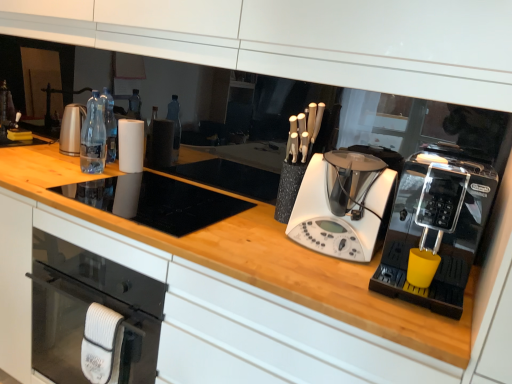
Question: Does white plastic blender at center, acting as the second home appliance starting from the right, appear on the right side of clear plastic bottles at center?

Choices:
 (A) yes
 (B) no

Answer: (A)

Question: Does white plastic blender at center, acting as the second home appliance starting from the right, have a lesser height compared to clear plastic bottles at center?

Choices:
 (A) yes
 (B) no

Answer: (A)

Question: Considering the relative sizes of white plastic blender at center, acting as the second home appliance starting from the right, and clear plastic bottles at center in the image provided, is white plastic blender at center, acting as the second home appliance starting from the right, bigger than clear plastic bottles at center?

Choices:
 (A) yes
 (B) no

Answer: (A)

Question: Does white plastic blender at center, acting as the second home appliance starting from the right, appear on the left side of clear plastic bottles at center?

Choices:
 (A) no
 (B) yes

Answer: (A)

Question: Is white plastic blender at center, which ranks as the 1th home appliance in left-to-right order, positioned beyond the bounds of clear plastic bottles at center?

Choices:
 (A) no
 (B) yes

Answer: (B)

Question: Considering the positions of white plastic blender at center, acting as the second home appliance starting from the right, and white matte paper towel at center in the image, is white plastic blender at center, acting as the second home appliance starting from the right, taller or shorter than white matte paper towel at center?

Choices:
 (A) tall
 (B) short

Answer: (A)

Question: In the image, is white plastic blender at center, acting as the second home appliance starting from the right, on the left side or the right side of white matte paper towel at center?

Choices:
 (A) right
 (B) left

Answer: (A)

Question: Does point (320, 223) appear closer or farther from the camera than point (139, 170)?

Choices:
 (A) closer
 (B) farther

Answer: (A)

Question: Choose the correct answer: Is white plastic blender at center, acting as the second home appliance starting from the right, inside white matte paper towel at center or outside it?

Choices:
 (A) inside
 (B) outside

Answer: (B)

Question: Looking at their shapes, would you say clear plastic bottles at center is wider or thinner than white plastic blender at center, acting as the second home appliance starting from the right?

Choices:
 (A) wide
 (B) thin

Answer: (B)

Question: Based on their positions, is clear plastic bottles at center located to the left or right of white plastic blender at center, acting as the second home appliance starting from the right?

Choices:
 (A) right
 (B) left

Answer: (B)

Question: Is clear plastic bottles at center taller or shorter than white plastic blender at center, acting as the second home appliance starting from the right?

Choices:
 (A) short
 (B) tall

Answer: (B)

Question: Is clear plastic bottles at center bigger or smaller than white plastic blender at center, acting as the second home appliance starting from the right?

Choices:
 (A) small
 (B) big

Answer: (A)

Question: From a real-world perspective, is white matte paper towel at center above or below black plastic coffee machine at right, which is the 1th home appliance from right to left?

Choices:
 (A) above
 (B) below

Answer: (B)

Question: From the image's perspective, is white matte paper towel at center positioned above or below black plastic coffee machine at right, arranged as the second home appliance when viewed from the left?

Choices:
 (A) below
 (B) above

Answer: (B)